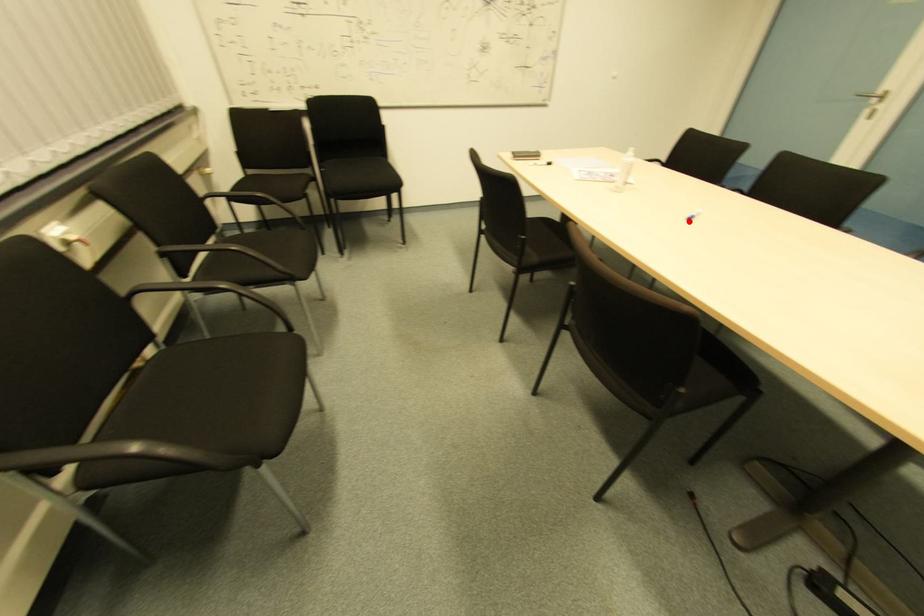
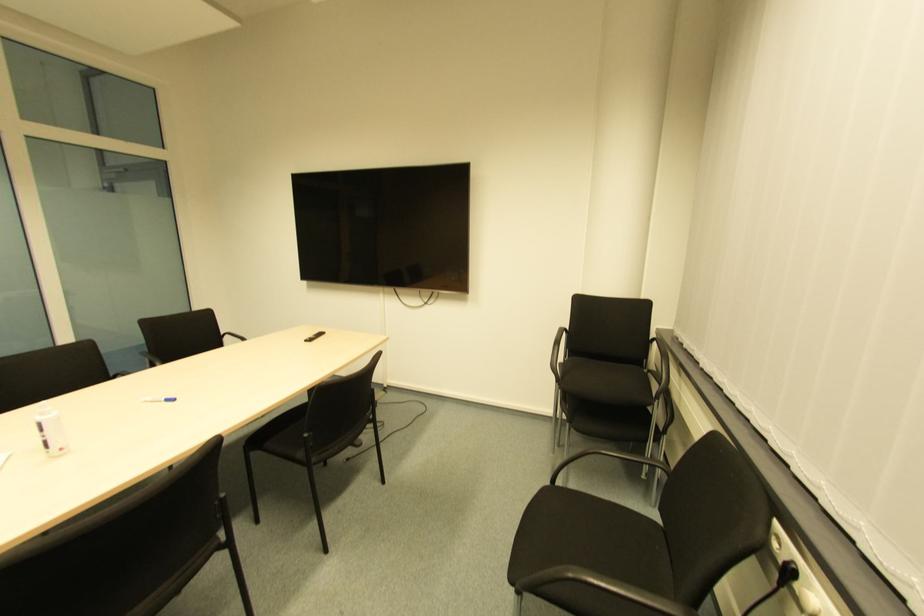
Question: I am providing you with two images of the same scene from different viewpoints. A red point is marked on the first image. Is the red point's position out of view in image 2?

Choices:
 (A) Yes
 (B) No

Answer: (B)